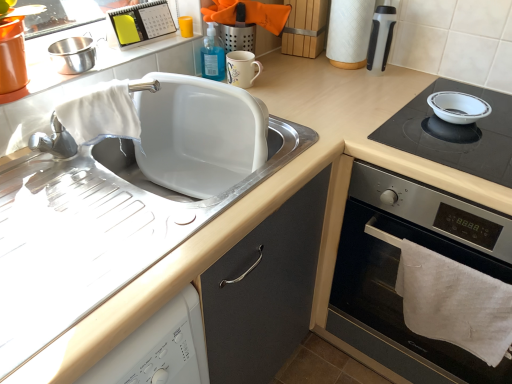
You are a GUI agent. You are given a task and a screenshot of the screen. Output one action in this format:
    pyautogui.click(x=<x>, y=<y>)
    Task: Click on the vacant space that is to the left of matte black thermos at upper right, acting as the fourth appliance starting from the left
    Image resolution: width=512 pixels, height=384 pixels.
    Given the screenshot: What is the action you would take?
    (x=320, y=77)